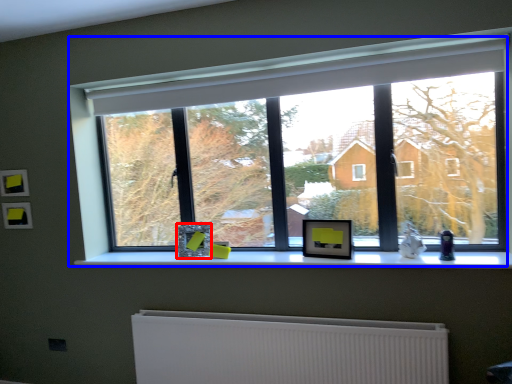
Question: Which object appears closest to the camera in this image, picture frame (highlighted by a red box) or window (highlighted by a blue box)?

Choices:
 (A) picture frame
 (B) window

Answer: (B)